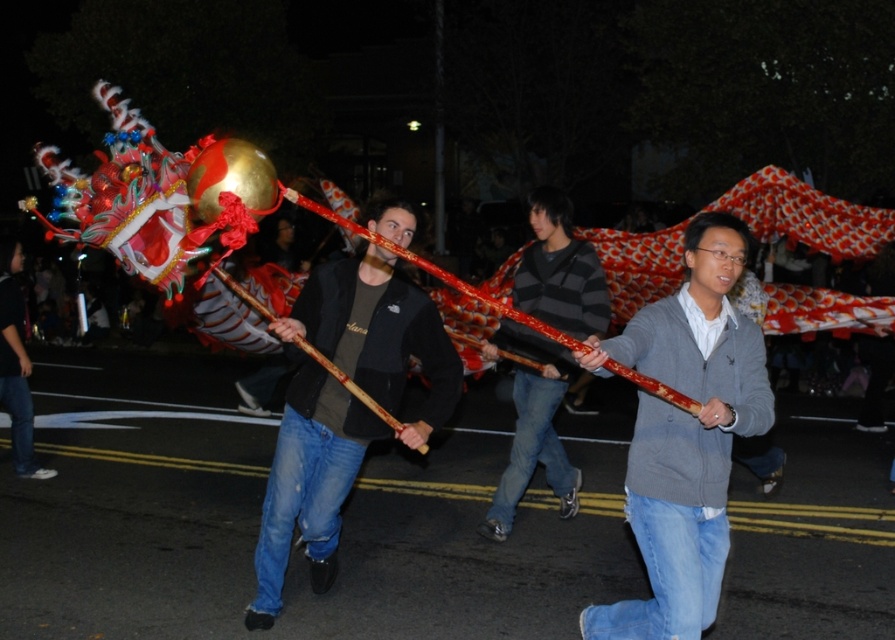
Question: Which object is closer to the camera taking this photo?

Choices:
 (A) matte black jacket at center
 (B) gray sweater at center

Answer: (B)

Question: Which point is farther to the camera?

Choices:
 (A) 527,392
 (B) 408,428
 (C) 615,337

Answer: (A)

Question: From the image, what is the correct spatial relationship of gray sweater at center in relation to striped sweater at center?

Choices:
 (A) right
 (B) left

Answer: (A)

Question: Does gray sweater at center appear under matte black jacket at center?

Choices:
 (A) no
 (B) yes

Answer: (B)

Question: Is gray sweater at center positioned behind matte black jacket at center?

Choices:
 (A) no
 (B) yes

Answer: (A)

Question: Which object is positioned farthest from the matte black jacket at center?

Choices:
 (A) gray sweater at center
 (B) striped sweater at center

Answer: (A)